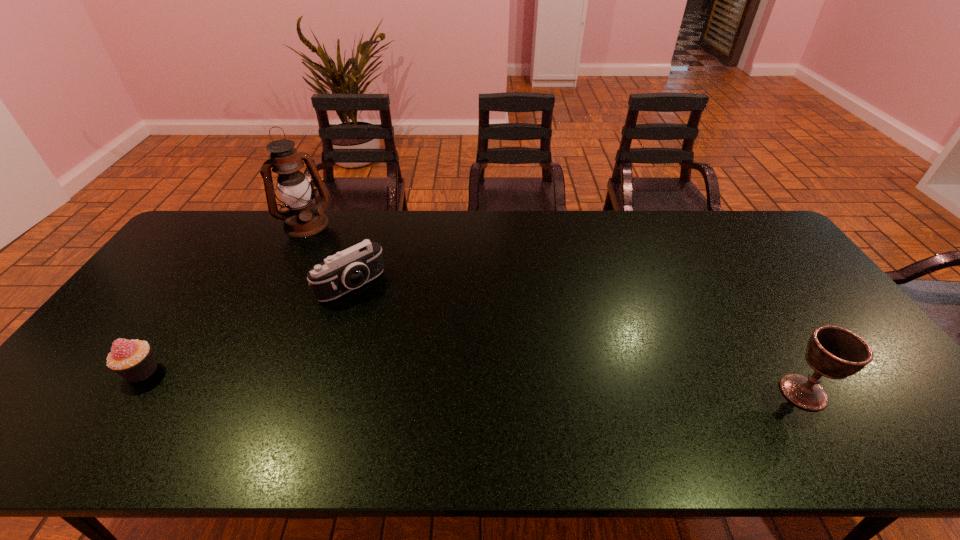
Image resolution: width=960 pixels, height=540 pixels. Find the location of `free point located 0.310m on the front lens of the camera`. free point located 0.310m on the front lens of the camera is located at coordinates 432,364.

Locate an element on the screen. Image resolution: width=960 pixels, height=540 pixels. free location located on the front lens of the camera is located at coordinates (427, 359).

This screenshot has height=540, width=960. What are the coordinates of `vacant area situated on the front lens of the camera` in the screenshot? It's located at (387, 319).

Identify the location of vacant space located on the side of the farthest object, there is a wick adjustment knob. Image resolution: width=960 pixels, height=540 pixels. (346, 300).

Locate an element on the screen. The width and height of the screenshot is (960, 540). free space located 0.260m on the side of the farthest object, there is a wick adjustment knob is located at coordinates (335, 279).

Locate an element on the screen. This screenshot has height=540, width=960. free space located on the side of the farthest object, there is a wick adjustment knob is located at coordinates (317, 243).

Where is `object that is positioned at the far edge`? object that is positioned at the far edge is located at coordinates (302, 219).

Locate an element on the screen. This screenshot has width=960, height=540. cupcake at the near edge is located at coordinates (132, 359).

This screenshot has width=960, height=540. Find the location of `chalice present at the near edge`. chalice present at the near edge is located at coordinates 834,352.

Identify the location of object present at the left edge. This screenshot has height=540, width=960. (132, 359).